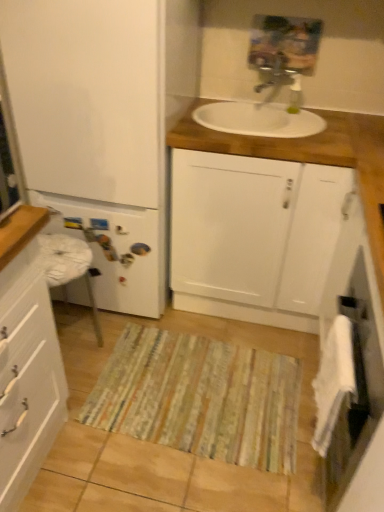
The image size is (384, 512). Identify the location of free spot above striped fabric doormat at center (from a real-world perspective). (203, 382).